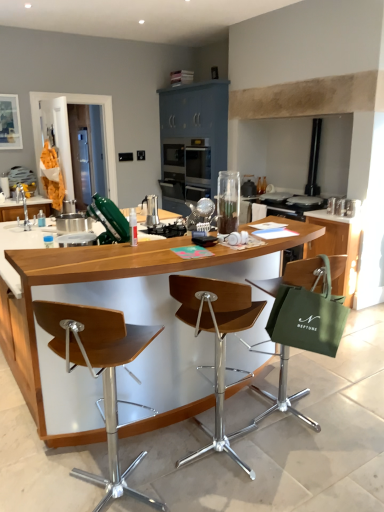
Question: Is green fabric shopping bag at right completely or partially outside of wooden seat at center, which appears as the 2th chair when viewed from the left?

Choices:
 (A) yes
 (B) no

Answer: (A)

Question: From the image's perspective, is green fabric shopping bag at right below wooden seat at center, which appears as the 2th chair when viewed from the left?

Choices:
 (A) yes
 (B) no

Answer: (B)

Question: Is green fabric shopping bag at right turned away from wooden seat at center, which appears as the 2th chair when viewed from the left?

Choices:
 (A) no
 (B) yes

Answer: (A)

Question: Can you confirm if green fabric shopping bag at right is smaller than wooden seat at center, marked as the 2th chair in a right-to-left arrangement?

Choices:
 (A) no
 (B) yes

Answer: (B)

Question: From a real-world perspective, is green fabric shopping bag at right beneath wooden seat at center, which appears as the 2th chair when viewed from the left?

Choices:
 (A) no
 (B) yes

Answer: (A)

Question: From a real-world perspective, is wooden seat at center, which appears as the 2th chair when viewed from the left, physically located above or below wooden table at center?

Choices:
 (A) below
 (B) above

Answer: (A)

Question: Considering the positions of wooden seat at center, which appears as the 2th chair when viewed from the left, and wooden table at center in the image, is wooden seat at center, which appears as the 2th chair when viewed from the left, taller or shorter than wooden table at center?

Choices:
 (A) short
 (B) tall

Answer: (A)

Question: From the image's perspective, is wooden seat at center, marked as the 2th chair in a right-to-left arrangement, located above or below wooden table at center?

Choices:
 (A) above
 (B) below

Answer: (B)

Question: Is wooden seat at center, marked as the 2th chair in a right-to-left arrangement, spatially inside wooden table at center, or outside of it?

Choices:
 (A) outside
 (B) inside

Answer: (B)

Question: Is wooden seat at center, the 1th chair positioned from the left, inside or outside of green fabric bag at right, arranged as the first cabinetry when viewed from the right?

Choices:
 (A) inside
 (B) outside

Answer: (B)

Question: Considering the positions of point (122, 330) and point (327, 223), is point (122, 330) closer or farther from the camera than point (327, 223)?

Choices:
 (A) closer
 (B) farther

Answer: (A)

Question: In terms of width, does wooden seat at center, the 1th chair positioned from the left, look wider or thinner when compared to green fabric bag at right, which is counted as the second cabinetry, starting from the top?

Choices:
 (A) thin
 (B) wide

Answer: (A)

Question: Considering the positions of wooden seat at center, the 1th chair positioned from the left, and green fabric bag at right, arranged as the first cabinetry when viewed from the right, in the image, is wooden seat at center, the 1th chair positioned from the left, taller or shorter than green fabric bag at right, arranged as the first cabinetry when viewed from the right,?

Choices:
 (A) tall
 (B) short

Answer: (A)

Question: From the image's perspective, is satin silver coffee maker at center positioned above or below green fabric chair at right, the first chair when ordered from right to left?

Choices:
 (A) below
 (B) above

Answer: (B)

Question: Is satin silver coffee maker at center bigger or smaller than green fabric chair at right, the first chair when ordered from right to left?

Choices:
 (A) small
 (B) big

Answer: (A)